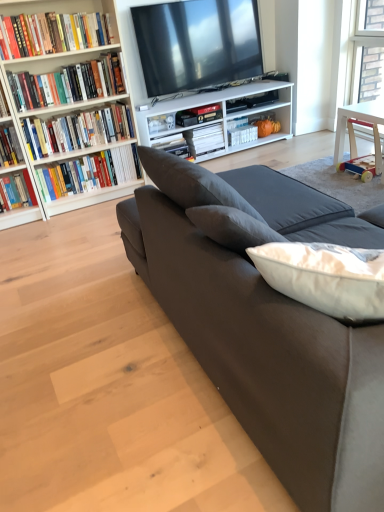
At what (x,y) coordinates should I click in order to perform the action: click on empty space that is ontop of hardcover book at upper left, which appears as the 1th book when viewed from the front (from a real-world perspective). Please return your answer as a coordinate pair (x, y). Looking at the image, I should click on (47, 3).